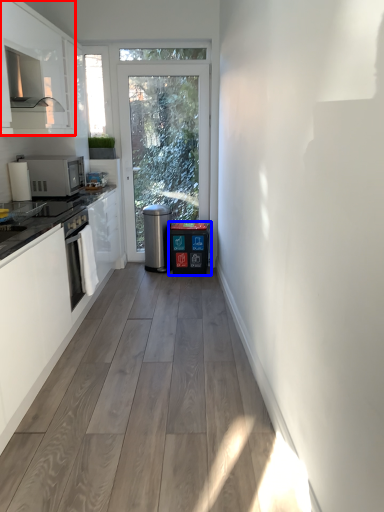
Question: Which object appears farthest to the camera in this image, cabinetry (highlighted by a red box) or dish washer (highlighted by a blue box)?

Choices:
 (A) cabinetry
 (B) dish washer

Answer: (B)